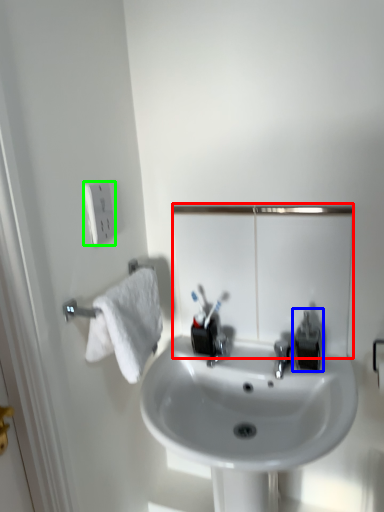
Question: Which object is the closest to the mirror (highlighted by a red box)? Choose among these: plumbing fixture (highlighted by a blue box) or electric outlet (highlighted by a green box).

Choices:
 (A) plumbing fixture
 (B) electric outlet

Answer: (A)